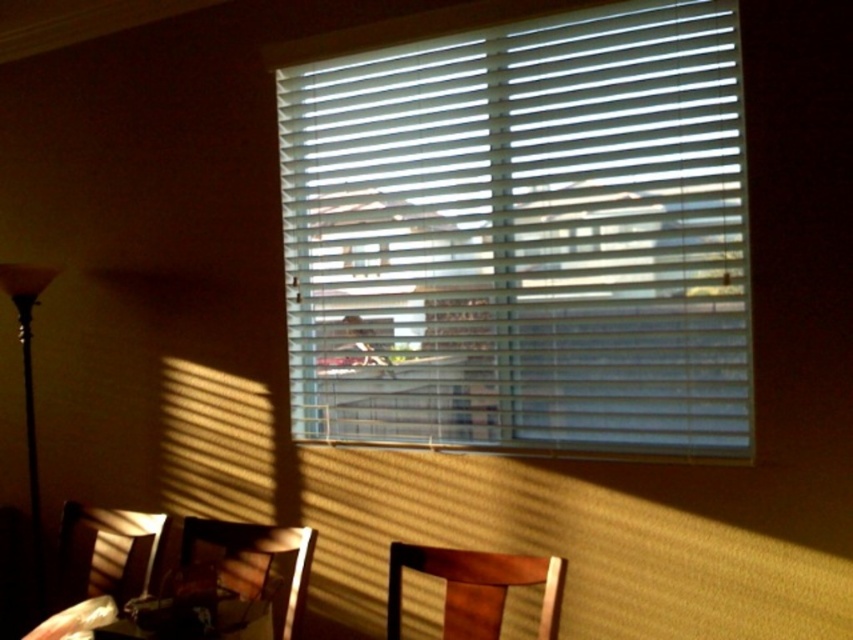
Consider the image. You are a delivery person trying to place a package between the wooden chair at lower center and the wooden armchair at lower center. The package measures 45 centimeters in length. Will it fit in the space between them?

The distance between the wooden chair at lower center and the wooden armchair at lower center is 43.87 centimeters. Since the package is 45 centimeters long, it will not fit in the space between them.

You are sitting on the wooden chair at lower center and want to reach the black glass floor lamp at left. Can you easily reach it without moving from your seat?

The wooden chair at lower center is located below the black glass floor lamp at left, so you are sitting lower than the lamp. Since the lamp is higher up, you might need to stretch or stand to reach it comfortably.

You are sitting on the wooden chair at lower center and want to look up at the white plastic blinds at upper center. Can you see them directly above you?

Yes, the white plastic blinds at upper center are positioned above the wooden chair at lower center, so you can see them directly above you.